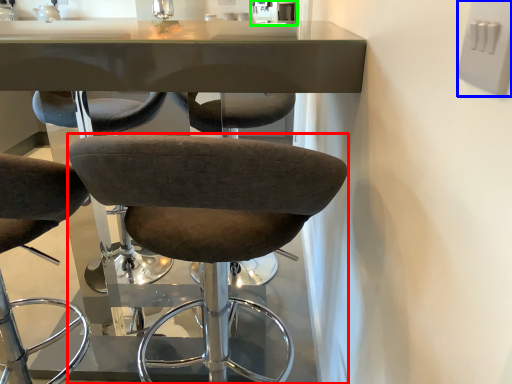
Question: Based on their relative distances, which object is farther from chair (highlighted by a red box)? Choose from electric outlet (highlighted by a blue box) and sink (highlighted by a green box).

Choices:
 (A) electric outlet
 (B) sink

Answer: (B)